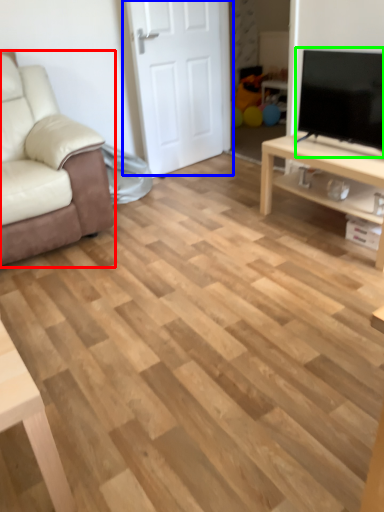
Question: Which is farther away from chair (highlighted by a red box)? door (highlighted by a blue box) or television (highlighted by a green box)?

Choices:
 (A) door
 (B) television

Answer: (B)